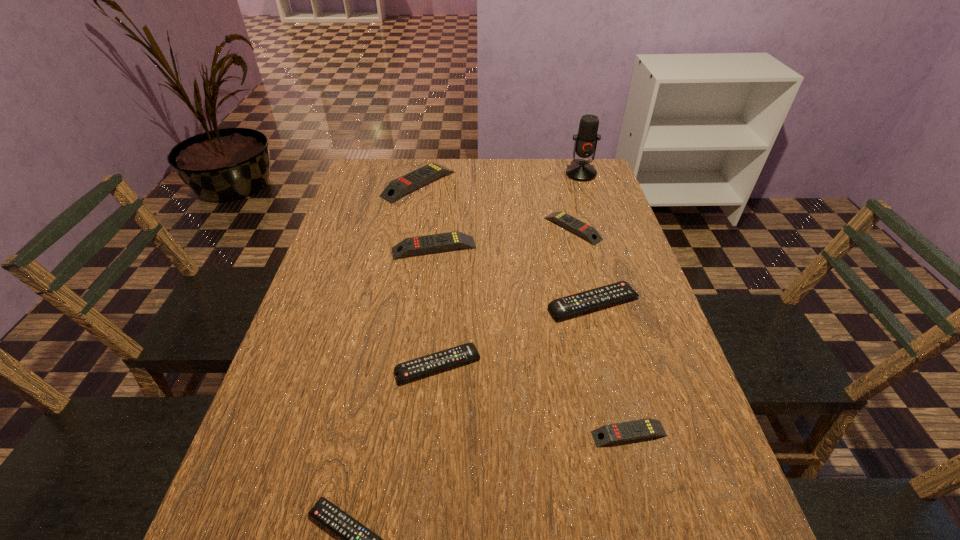
Image resolution: width=960 pixels, height=540 pixels. I want to click on microphone that is at the far edge, so click(585, 145).

Locate an element on the screen. The width and height of the screenshot is (960, 540). remote control situated at the far edge is located at coordinates (397, 188).

You are a GUI agent. You are given a task and a screenshot of the screen. Output one action in this format:
    pyautogui.click(x=<x>, y=<y>)
    Task: Click on the object present at the left edge
    
    Given the screenshot: What is the action you would take?
    pyautogui.click(x=397, y=188)

What are the coordinates of `microphone situated at the right edge` in the screenshot? It's located at 585,145.

You are a GUI agent. You are given a task and a screenshot of the screen. Output one action in this format:
    pyautogui.click(x=<x>, y=<y>)
    Task: Click on the object located at the far left corner
    The height and width of the screenshot is (540, 960).
    Given the screenshot: What is the action you would take?
    pyautogui.click(x=397, y=188)

Where is `object present at the far right corner`? object present at the far right corner is located at coordinates (585, 145).

The width and height of the screenshot is (960, 540). I want to click on vacant space at the far edge, so click(430, 184).

Image resolution: width=960 pixels, height=540 pixels. I want to click on free space at the left edge of the desktop, so click(379, 234).

I want to click on vacant region at the right edge of the desktop, so click(615, 281).

You are a GUI agent. You are given a task and a screenshot of the screen. Output one action in this format:
    pyautogui.click(x=<x>, y=<y>)
    Task: Click on the free region at the far right corner of the desktop
    The height and width of the screenshot is (540, 960).
    Given the screenshot: What is the action you would take?
    pyautogui.click(x=600, y=183)